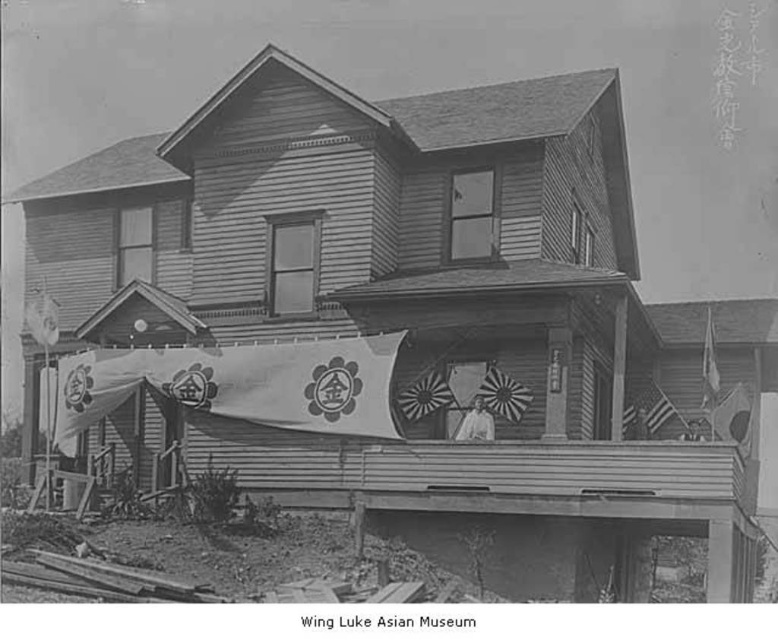
You are standing in front of the house and want to determine the relative positions of two points marked on the image. Which point is closer to you, point (703, 337) or point (652, 429)?

Point (703, 337) is further to the viewer than point (652, 429), so point (652, 429) is closer to you.

You are a guest at the event and want to take a photo of the white fabric flag at center and the white fabric banner at left. Which one should you focus on first if you want to capture both in the same frame without moving your camera?

You should focus on the white fabric banner at left first because it is above the white fabric flag at center, so adjusting the camera angle to include both would require framing from the top down.

You are a guest at the event and want to take a photo with both the white fabric flag at center and the white fabric banner at left. Which one should you stand closer to in order to include both in your photo without cropping?

Since the white fabric flag at center is shorter than the white fabric banner at left, you should stand closer to the white fabric flag at center to ensure both fit in the photo.